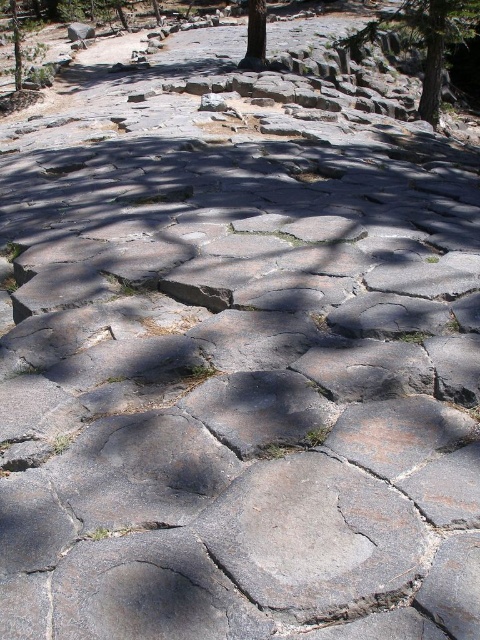
Question: Is brown rough bark tree at upper center smaller than green textured tree at upper left?

Choices:
 (A) no
 (B) yes

Answer: (B)

Question: Which point is closer to the camera taking this photo?

Choices:
 (A) (262, 61)
 (B) (15, 16)
 (C) (375, 33)

Answer: (A)

Question: Is green textured tree at upper right above brown rough bark tree at upper center?

Choices:
 (A) yes
 (B) no

Answer: (A)

Question: Does green textured tree at upper right appear on the left side of brown rough bark tree at upper center?

Choices:
 (A) no
 (B) yes

Answer: (A)

Question: Considering the real-world distances, which object is closest to the green textured tree at upper left?

Choices:
 (A) green textured tree at upper right
 (B) brown rough bark tree at upper center

Answer: (A)

Question: Among these objects, which one is nearest to the camera?

Choices:
 (A) green textured tree at upper right
 (B) green textured tree at upper left
 (C) brown rough bark tree at upper center

Answer: (A)